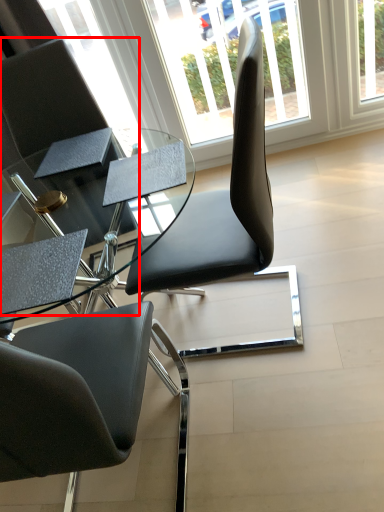
Question: From the image's perspective, what is the correct spatial positioning of chair (annotated by the red box) in reference to window?

Choices:
 (A) above
 (B) below

Answer: (B)